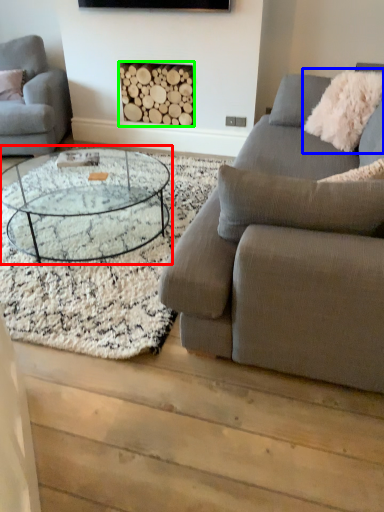
Question: Which object is positioned farthest from coffee table (highlighted by a red box)? Select from pillow (highlighted by a blue box) and fireplace (highlighted by a green box).

Choices:
 (A) pillow
 (B) fireplace

Answer: (A)